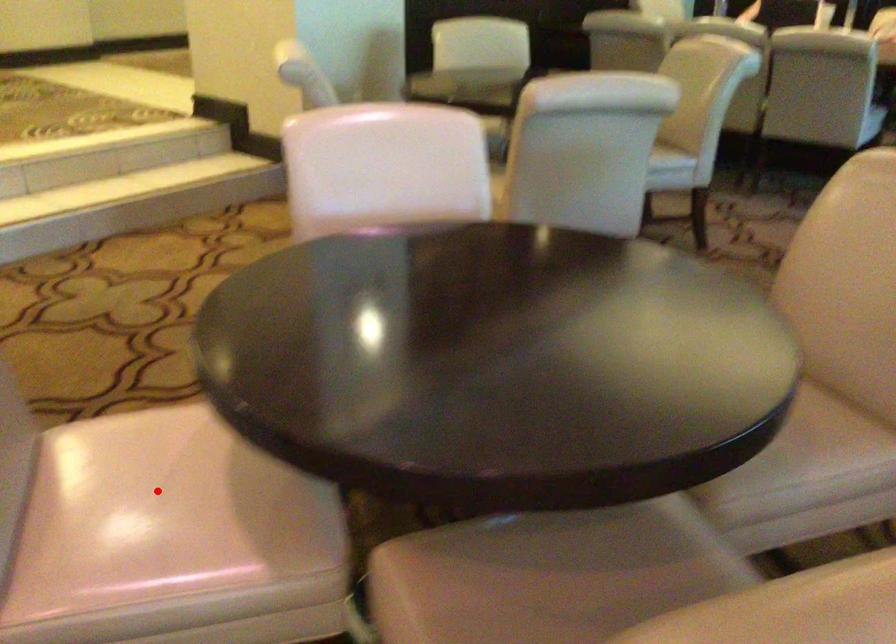
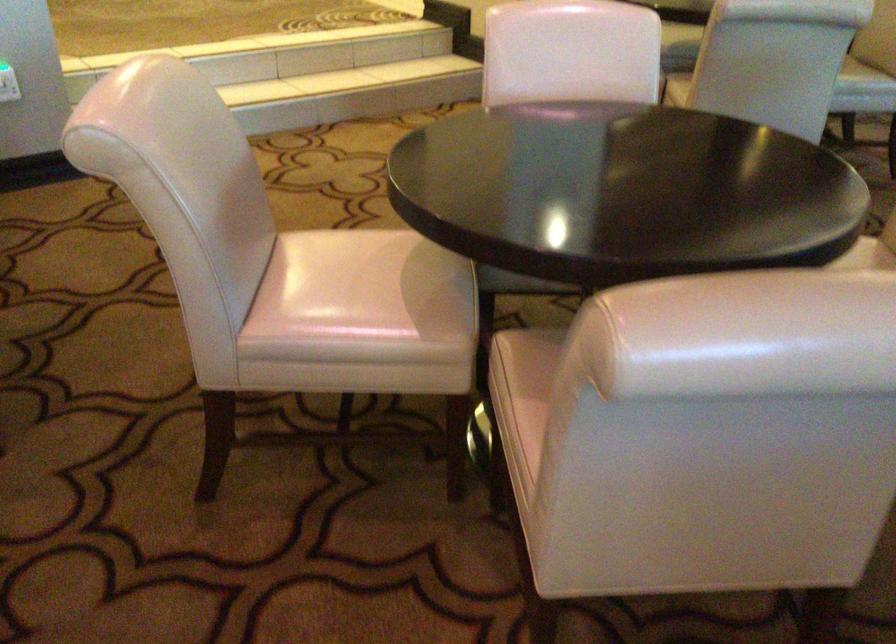
Question: A red point is marked in image1. In image2, is the corresponding 3D point closer to the camera or farther? Reply with the corresponding letter.

Choices:
 (A) The corresponding 3D point is closer.
 (B) The corresponding 3D point is farther.

Answer: (B)